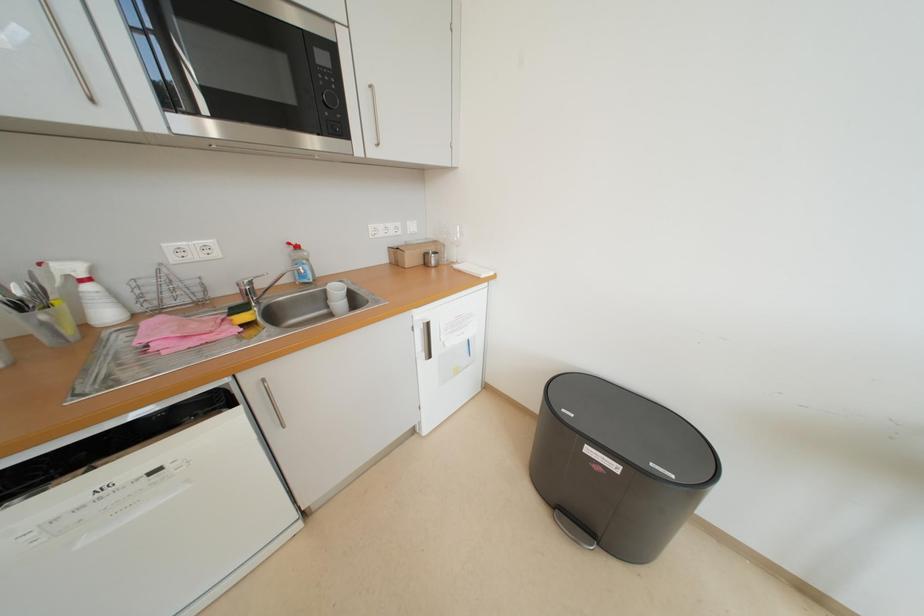
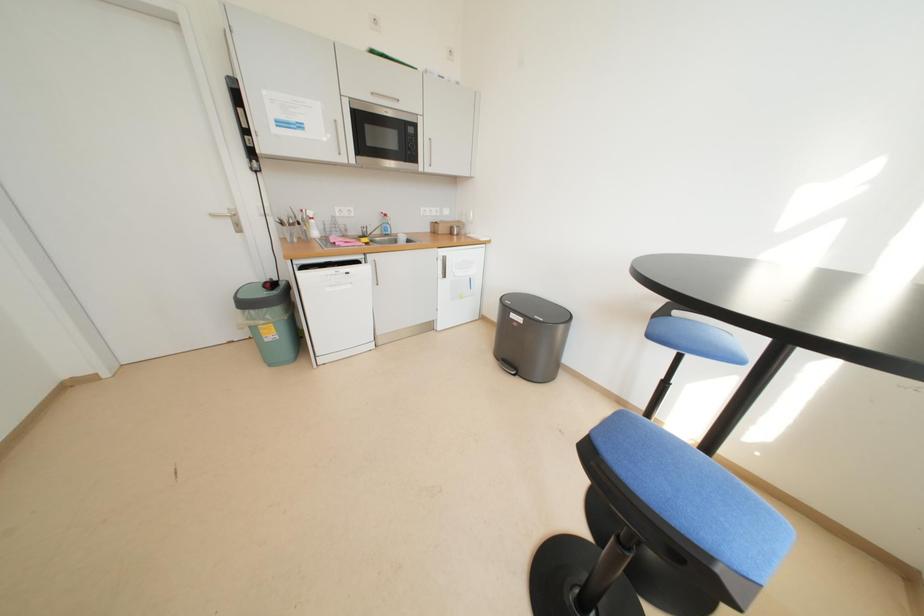
In a continuous first-person perspective shot, in which direction is the camera moving?

The cameraman walked toward right, backward.